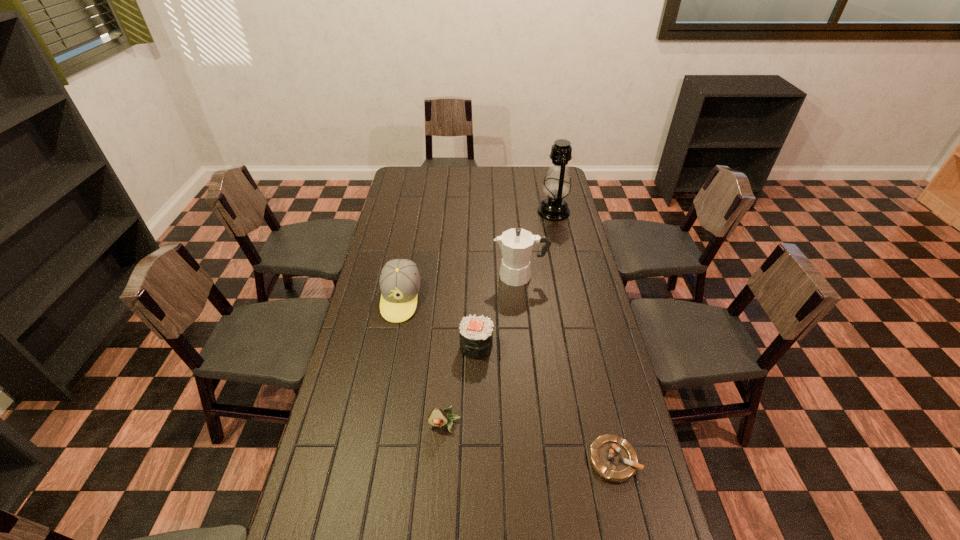
Locate an element on the screen. the tallest object is located at coordinates (557, 185).

Locate an element on the screen. Image resolution: width=960 pixels, height=540 pixels. the farthest object is located at coordinates (557, 185).

The image size is (960, 540). I want to click on the third object from right to left, so pos(516,244).

The width and height of the screenshot is (960, 540). I want to click on coffeepot, so click(x=516, y=244).

The height and width of the screenshot is (540, 960). Identify the location of the fourth shortest object. (399, 281).

Locate an element on the screen. Image resolution: width=960 pixels, height=540 pixels. the leftmost object is located at coordinates (399, 281).

Image resolution: width=960 pixels, height=540 pixels. Identify the location of sushi. (476, 333).

The width and height of the screenshot is (960, 540). I want to click on avocado, so click(x=437, y=417).

Locate an element on the screen. This screenshot has height=540, width=960. the shortest object is located at coordinates (613, 458).

Image resolution: width=960 pixels, height=540 pixels. I want to click on the nearest object, so click(613, 458).